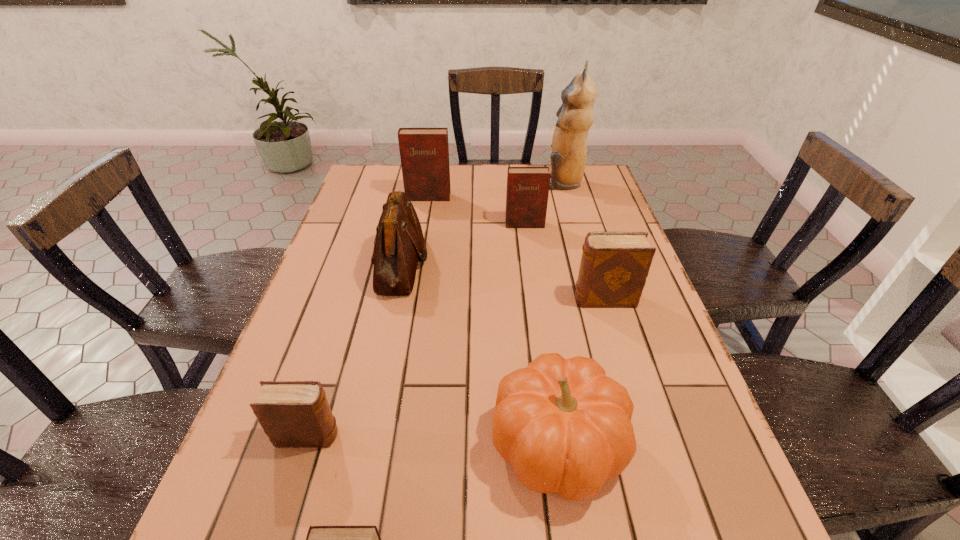
The height and width of the screenshot is (540, 960). I want to click on the leftmost diary, so click(295, 414).

I want to click on the left brown diary, so click(x=295, y=414).

Locate an element on the screen. The height and width of the screenshot is (540, 960). free point located 0.350m on the face of the cat is located at coordinates (442, 182).

The image size is (960, 540). What are the coordinates of `free location located on the face of the cat` in the screenshot? It's located at (468, 182).

You are a GUI agent. You are given a task and a screenshot of the screen. Output one action in this format:
    pyautogui.click(x=<x>, y=<y>)
    Task: Click on the free location located 0.230m on the face of the cat
    The width and height of the screenshot is (960, 540).
    Given the screenshot: What is the action you would take?
    pyautogui.click(x=476, y=182)

You are a GUI agent. You are given a task and a screenshot of the screen. Output one action in this format:
    pyautogui.click(x=<x>, y=<y>)
    Task: Click on the vacant area located 0.310m on the front cover of the biggest reddish-brown diary
    
    Given the screenshot: What is the action you would take?
    pyautogui.click(x=418, y=262)

Where is `free space located 0.370m on the right of the shoulder bag`? free space located 0.370m on the right of the shoulder bag is located at coordinates (565, 264).

The height and width of the screenshot is (540, 960). I want to click on free space located on the front cover of the second farthest diary, so click(530, 267).

Where is `vacant area situated on the spine side of the third nearest diary`? The height and width of the screenshot is (540, 960). vacant area situated on the spine side of the third nearest diary is located at coordinates (422, 299).

The height and width of the screenshot is (540, 960). What are the coordinates of `vacant region located 0.380m on the spine side of the third nearest diary` in the screenshot? It's located at (419, 299).